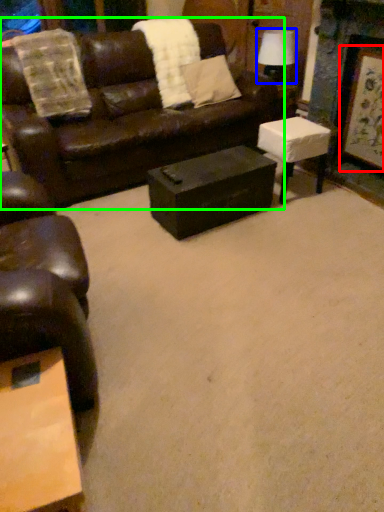
Question: Estimate the real-world distances between objects in this image. Which object is farther from picture frame (highlighted by a red box), lamp (highlighted by a blue box) or studio couch (highlighted by a green box)?

Choices:
 (A) lamp
 (B) studio couch

Answer: (B)